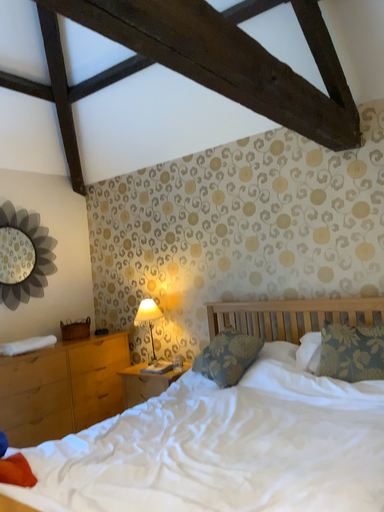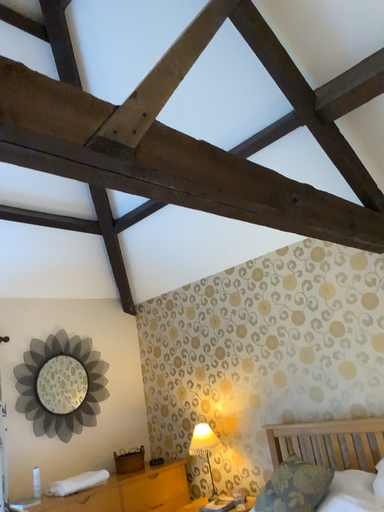
Question: Which way did the camera rotate in the video?

Choices:
 (A) rotated downward
 (B) rotated upward

Answer: (B)